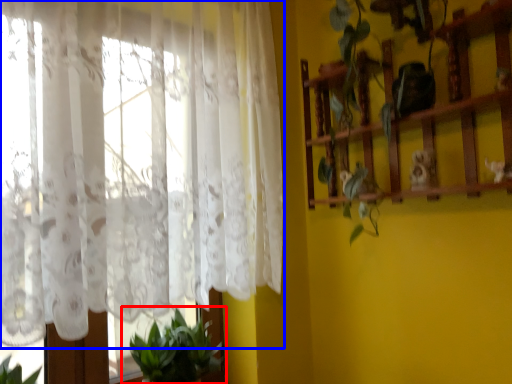
Question: Among these objects, which one is nearest to the camera, houseplant (highlighted by a red box) or curtain (highlighted by a blue box)?

Choices:
 (A) houseplant
 (B) curtain

Answer: (B)